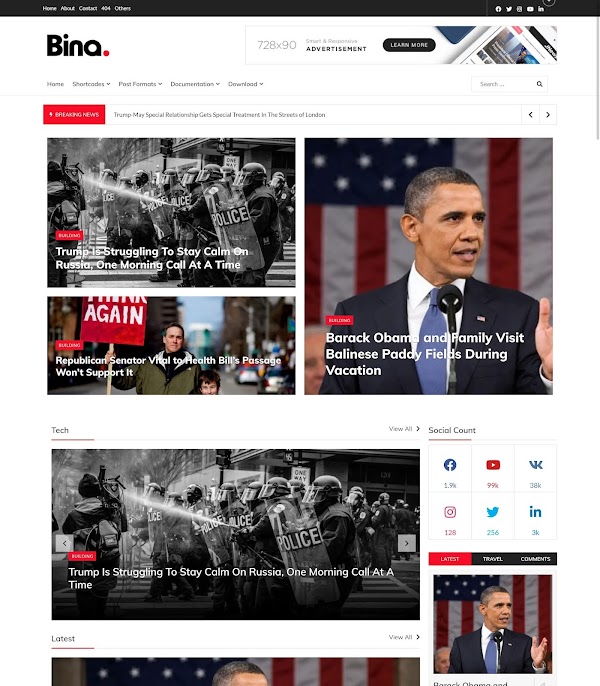
This screenshot has width=600, height=686. Find the location of `black and white picture`. black and white picture is located at coordinates (206, 510), (173, 191).